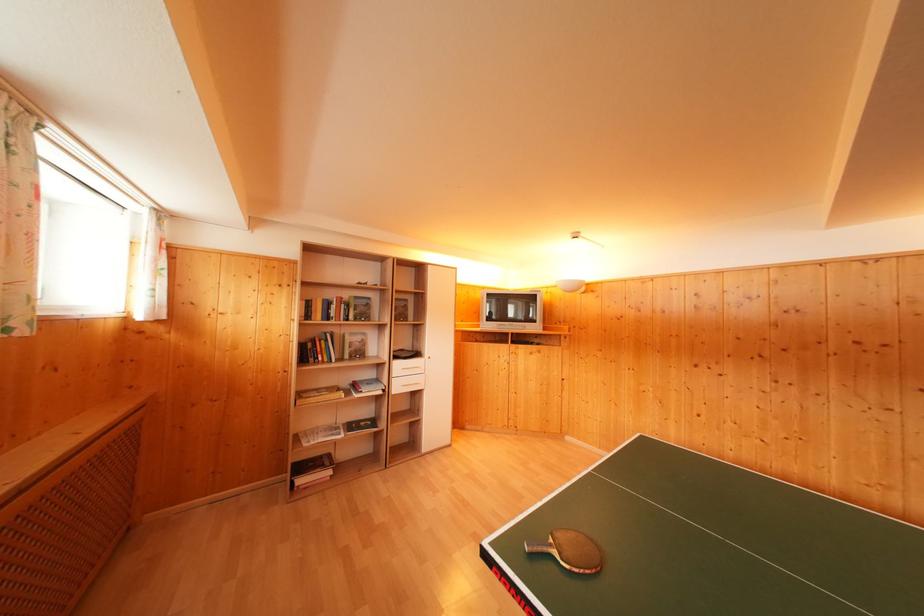
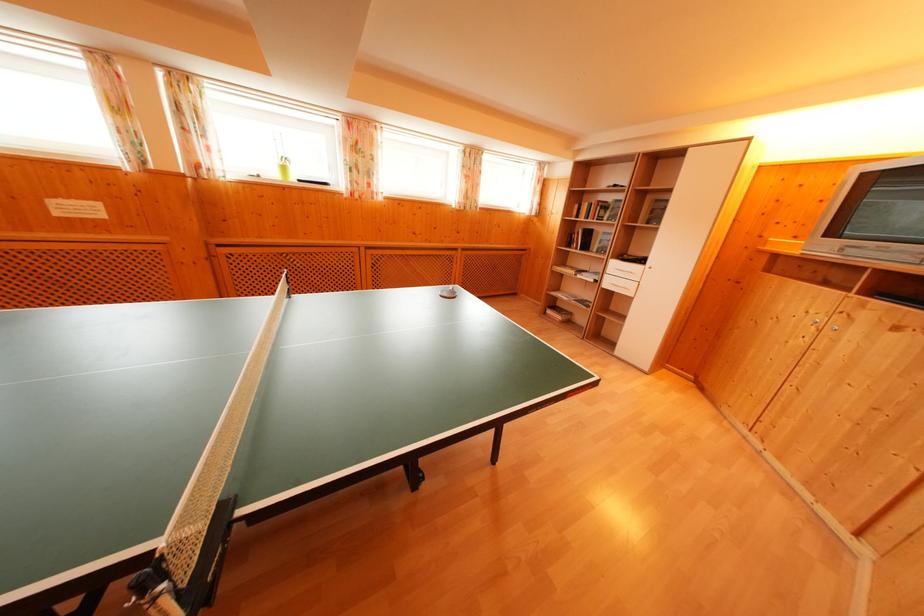
The point at (505, 362) is marked in the first image. Where is the corresponding point in the second image?

(817, 317)